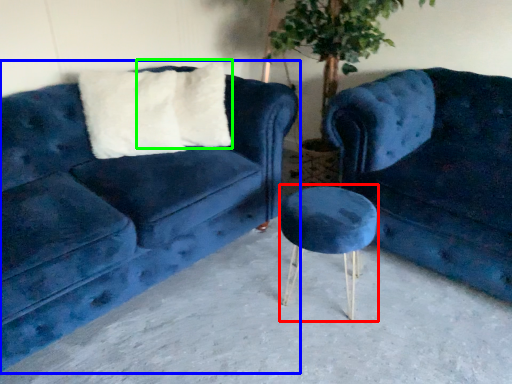
Question: Considering the real-world distances, which object is farthest from bar stool (highlighted by a red box)? studio couch (highlighted by a blue box) or pillow (highlighted by a green box)?

Choices:
 (A) studio couch
 (B) pillow

Answer: (B)